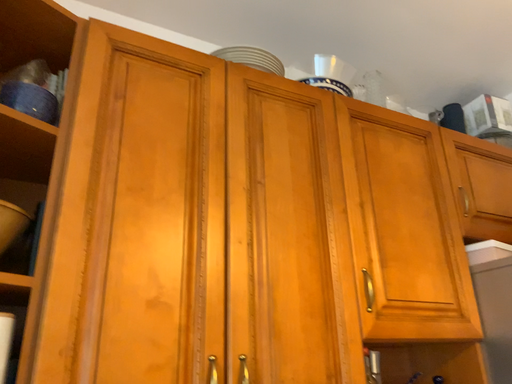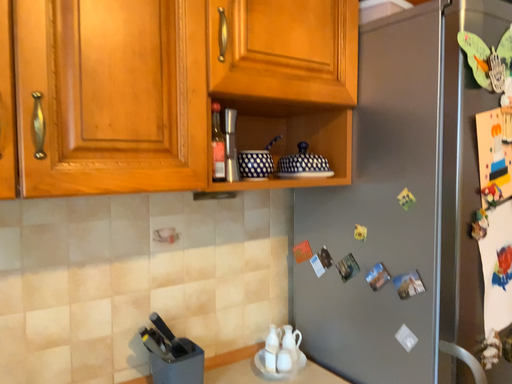
Question: Which way did the camera rotate in the video?

Choices:
 (A) rotated right
 (B) rotated left

Answer: (A)